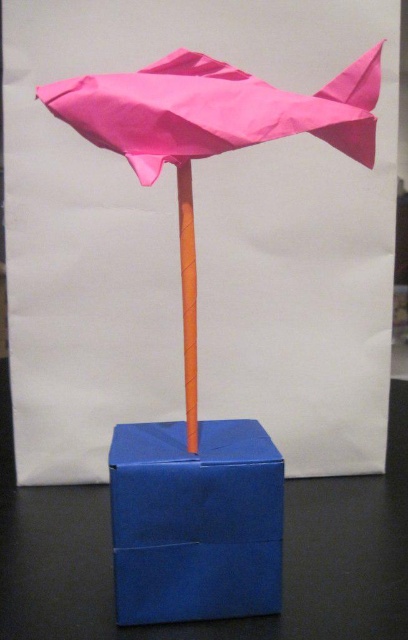
Question: Is pink paper fish at upper center above orange matte stick at center?

Choices:
 (A) yes
 (B) no

Answer: (A)

Question: Can you confirm if blue cardboard box at center is positioned above orange matte stick at center?

Choices:
 (A) no
 (B) yes

Answer: (A)

Question: Is blue cardboard box at center to the right of pink paper umbrella at center from the viewer's perspective?

Choices:
 (A) yes
 (B) no

Answer: (B)

Question: Which point is closer to the camera taking this photo?

Choices:
 (A) (195, 307)
 (B) (330, 140)

Answer: (B)

Question: Which object appears farthest from the camera in this image?

Choices:
 (A) pink paper umbrella at center
 (B) pink paper fish at upper center
 (C) blue cardboard box at center
 (D) orange matte stick at center

Answer: (D)

Question: Which point appears farthest from the camera in this image?

Choices:
 (A) (184, 173)
 (B) (139, 552)
 (C) (259, 122)

Answer: (A)